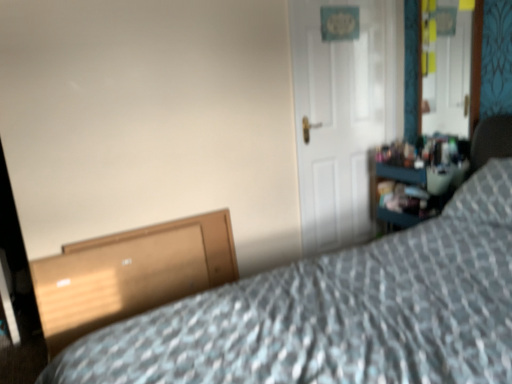
At what (x,y) coordinates should I click in order to perform the action: click on patterned fabric bed at lower right. Please return your answer as a coordinate pair (x, y). Looking at the image, I should click on [338, 312].

Describe the element at coordinates (452, 70) in the screenshot. I see `metallic mirror at upper right` at that location.

The image size is (512, 384). Find the location of `wooden file cabinet at lower left`. wooden file cabinet at lower left is located at coordinates (130, 274).

Where is `white matte door at center`? The height and width of the screenshot is (384, 512). white matte door at center is located at coordinates tap(343, 114).

What do you see at coordinates (343, 114) in the screenshot?
I see `white matte door at center` at bounding box center [343, 114].

At what (x,y) coordinates should I click in order to perform the action: click on wooden dresser at right. Please return your answer as a coordinate pair (x, y). This screenshot has width=512, height=384. Looking at the image, I should click on (425, 180).

Based on their positions, is wooden file cabinet at lower left located to the left or right of metallic mirror at upper right?

Clearly, wooden file cabinet at lower left is on the left of metallic mirror at upper right in the image.

Is wooden file cabinet at lower left beside metallic mirror at upper right?

No, wooden file cabinet at lower left is not making contact with metallic mirror at upper right.

Considering the positions of point (42, 323) and point (474, 106), is point (42, 323) closer or farther from the camera than point (474, 106)?

Clearly, point (42, 323) is closer to the camera than point (474, 106).

Can you confirm if metallic mirror at upper right is taller than white matte door at center?

Incorrect, the height of metallic mirror at upper right is not larger of that of white matte door at center.

Looking at this image, is metallic mirror at upper right located outside white matte door at center?

metallic mirror at upper right is positioned outside white matte door at center.

Is metallic mirror at upper right aimed at white matte door at center?

No, metallic mirror at upper right is not facing towards white matte door at center.

Which of these two, wooden dresser at right or metallic mirror at upper right, is thinner?

With smaller width is metallic mirror at upper right.

Looking at this image, from a real-world perspective, which object stands above the other?

metallic mirror at upper right.

Is wooden dresser at right spatially inside metallic mirror at upper right, or outside of it?

wooden dresser at right is located beyond the bounds of metallic mirror at upper right.

Is white matte door at center facing towards metallic mirror at upper right?

No, white matte door at center is not aimed at metallic mirror at upper right.

Is white matte door at center outside of metallic mirror at upper right?

Indeed, white matte door at center is completely outside metallic mirror at upper right.

Who is taller, white matte door at center or metallic mirror at upper right?

Standing taller between the two is white matte door at center.

Can you confirm if metallic mirror at upper right is thinner than patterned fabric bed at lower right?

Correct, the width of metallic mirror at upper right is less than that of patterned fabric bed at lower right.

Can patterned fabric bed at lower right be found inside metallic mirror at upper right?

Definitely not — patterned fabric bed at lower right is not inside metallic mirror at upper right.

Could you tell me if metallic mirror at upper right is turned towards patterned fabric bed at lower right?

No.

Which object is positioned more to the left, metallic mirror at upper right or patterned fabric bed at lower right?

From the viewer's perspective, patterned fabric bed at lower right appears more on the left side.

Relative to wooden dresser at right, is patterned fabric bed at lower right in front or behind?

Clearly, patterned fabric bed at lower right is in front of wooden dresser at right.

Between patterned fabric bed at lower right and wooden dresser at right, which one has larger size?

patterned fabric bed at lower right.

The width and height of the screenshot is (512, 384). Find the location of `bed in front of the wooden dresser at right`. bed in front of the wooden dresser at right is located at coordinates (338, 312).

Which is more to the right, patterned fabric bed at lower right or wooden dresser at right?

wooden dresser at right is more to the right.

From a real-world perspective, which is physically above, white matte door at center or wooden dresser at right?

white matte door at center.

In the image, is white matte door at center positioned in front of or behind wooden dresser at right?

white matte door at center is behind wooden dresser at right.

Based on the photo, is white matte door at center to the left of wooden dresser at right from the viewer's perspective?

Yes.

Is white matte door at center far from wooden dresser at right?

Actually, white matte door at center and wooden dresser at right are a little close together.

What are the coordinates of `file cabinet located underneath the metallic mirror at upper right (from a real-world perspective)` in the screenshot? It's located at (130, 274).

Identify the location of mirror that appears above the white matte door at center (from the image's perspective). (452, 70).

Looking at this image, based on their spatial positions, is wooden file cabinet at lower left or metallic mirror at upper right further from wooden dresser at right?

Based on the image, wooden file cabinet at lower left appears to be further to wooden dresser at right.

When comparing their distances from patterned fabric bed at lower right, does white matte door at center or metallic mirror at upper right seem further?

metallic mirror at upper right is further to patterned fabric bed at lower right.

When comparing their distances from white matte door at center, does patterned fabric bed at lower right or wooden dresser at right seem closer?

wooden dresser at right.

Looking at this image, estimate the real-world distances between objects in this image. Which object is closer to wooden file cabinet at lower left, white matte door at center or patterned fabric bed at lower right?

Based on the image, patterned fabric bed at lower right appears to be nearer to wooden file cabinet at lower left.

Looking at the image, which one is located closer to patterned fabric bed at lower right, metallic mirror at upper right or wooden file cabinet at lower left?

Based on the image, wooden file cabinet at lower left appears to be nearer to patterned fabric bed at lower right.

Looking at the image, which one is located further to wooden dresser at right, white matte door at center or metallic mirror at upper right?

The object further to wooden dresser at right is metallic mirror at upper right.

When comparing their distances from metallic mirror at upper right, does white matte door at center or patterned fabric bed at lower right seem further?

patterned fabric bed at lower right lies further to metallic mirror at upper right than the other object.

When comparing their distances from wooden dresser at right, does wooden file cabinet at lower left or white matte door at center seem closer?

The object closer to wooden dresser at right is white matte door at center.

The width and height of the screenshot is (512, 384). Find the location of `file cabinet between patterned fabric bed at lower right and metallic mirror at upper right along the z-axis`. file cabinet between patterned fabric bed at lower right and metallic mirror at upper right along the z-axis is located at coordinates (130, 274).

Image resolution: width=512 pixels, height=384 pixels. Find the location of `dresser between patterned fabric bed at lower right and white matte door at center in the front-back direction`. dresser between patterned fabric bed at lower right and white matte door at center in the front-back direction is located at coordinates (425, 180).

Identify the location of door that lies between metallic mirror at upper right and wooden dresser at right from top to bottom. (343, 114).

You are a GUI agent. You are given a task and a screenshot of the screen. Output one action in this format:
    pyautogui.click(x=<x>, y=<y>)
    Task: Click on the file cabinet between patterned fabric bed at lower right and white matte door at center in the front-back direction
    
    Given the screenshot: What is the action you would take?
    pyautogui.click(x=130, y=274)